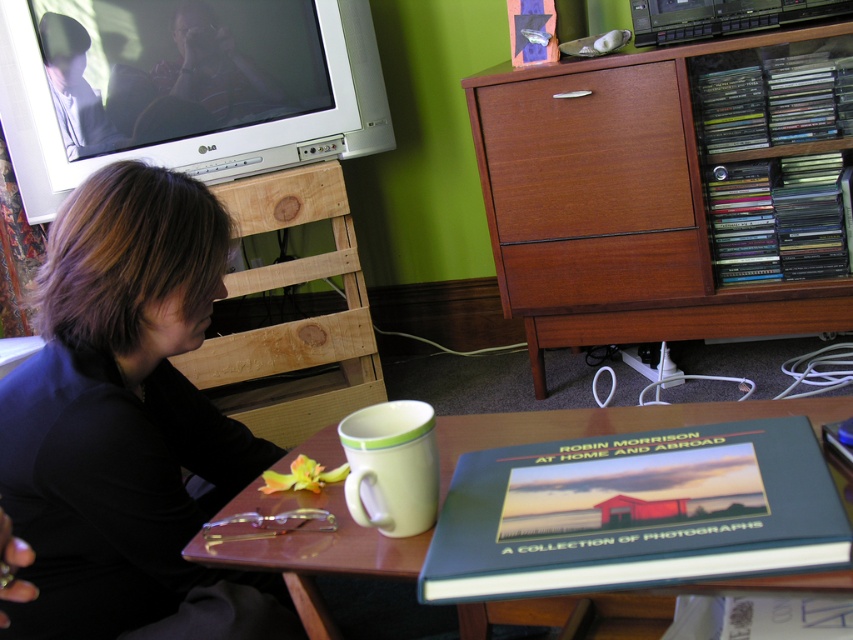
You are helping someone organize their closet. They have a black fabric shirt at left and a wooden table at lower center. Which item takes up more space?

The black fabric shirt at left has a larger size compared to the wooden table at lower center, so it takes up more space.